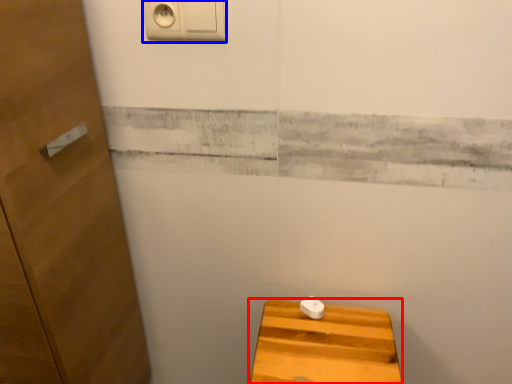
Question: Which point is further to the camera, furniture (highlighted by a red box) or light switch (highlighted by a blue box)?

Choices:
 (A) furniture
 (B) light switch

Answer: (A)